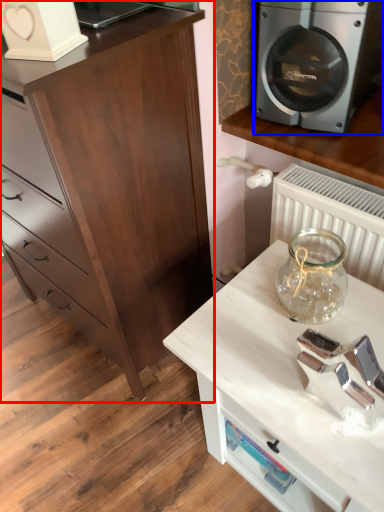
Question: Which object appears farthest to the camera in this image, chest of drawers (highlighted by a red box) or home appliance (highlighted by a blue box)?

Choices:
 (A) chest of drawers
 (B) home appliance

Answer: (B)